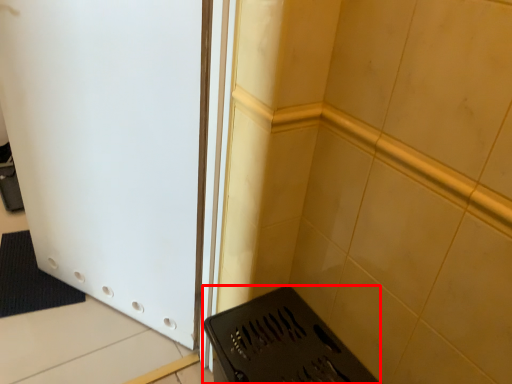
Question: From the image's perspective, what is the correct spatial relationship of appliance (annotated by the red box) in relation to door?

Choices:
 (A) above
 (B) below

Answer: (B)